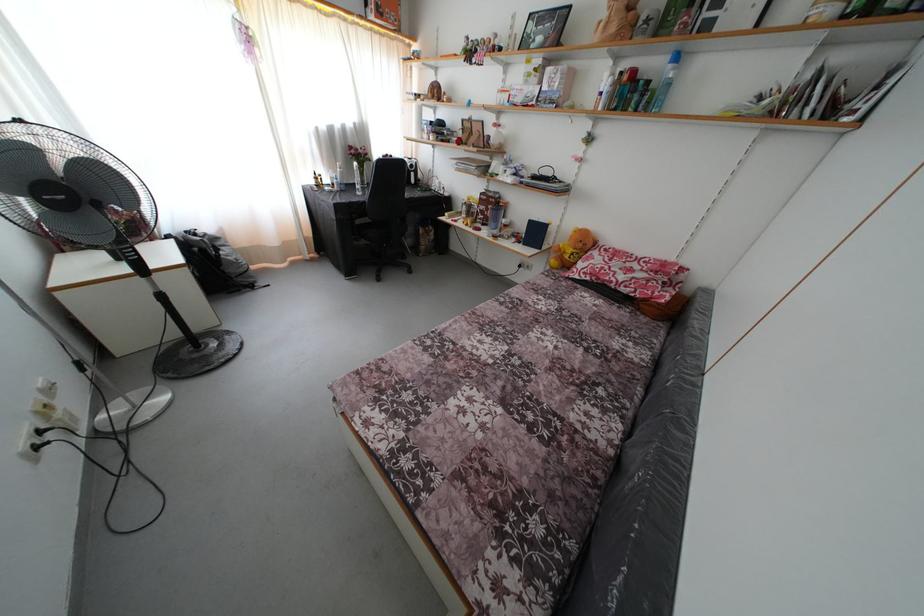
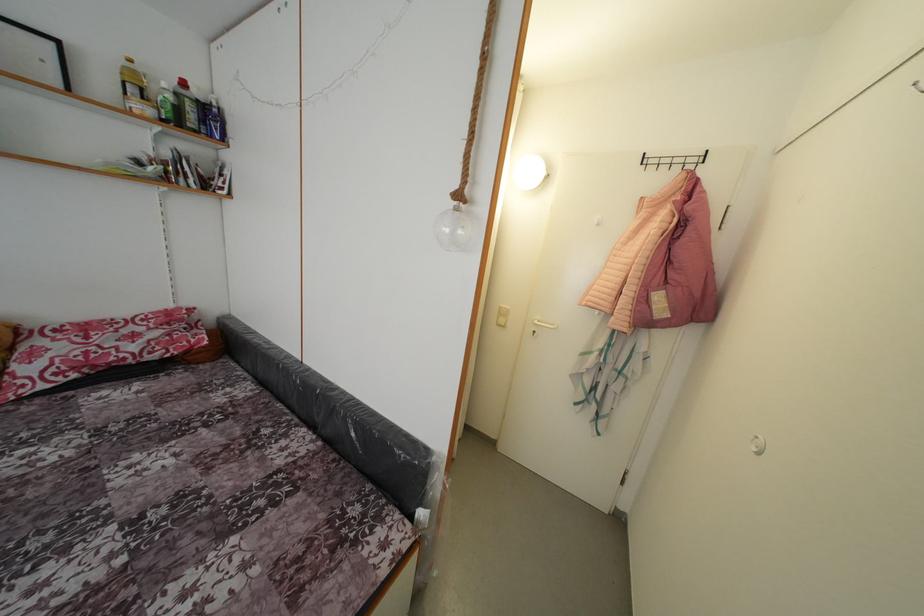
Based on the photo, based on the continuous images, in which direction is the camera rotating?

The camera rotated toward right-down.